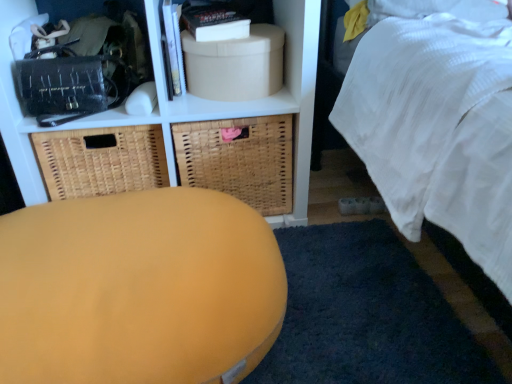
Identify the location of free space above beige cardboard box at upper center (from a real-world perspective). (244, 29).